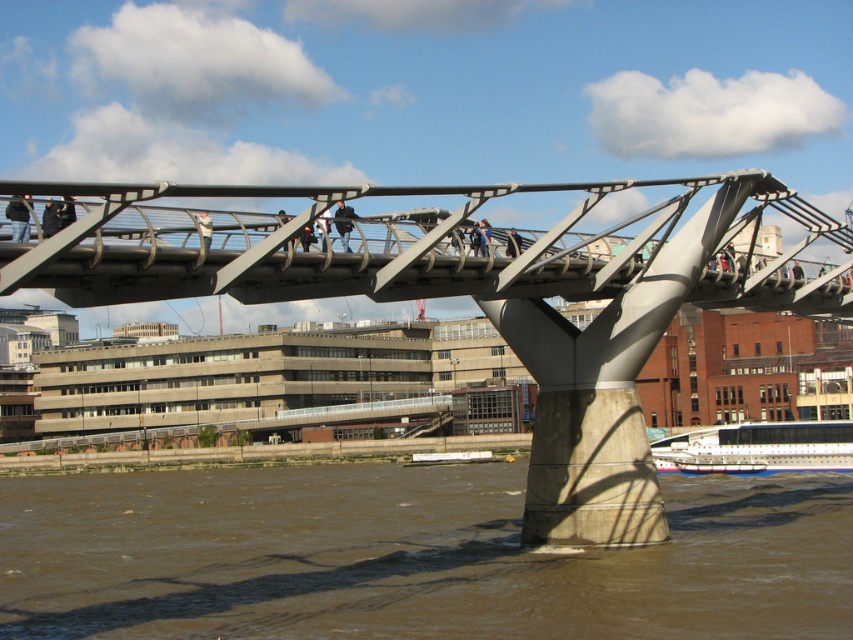
Is polished steel bridge at center bigger than dark blue jeans at center?

Correct, polished steel bridge at center is larger in size than dark blue jeans at center.

Find the location of a particular element. polished steel bridge at center is located at coordinates (473, 296).

What are the coordinates of `polished steel bridge at center` in the screenshot? It's located at (473, 296).

Measure the distance from dark blue jeans at center to black matte pedestrian at center.

dark blue jeans at center is 18.54 feet away from black matte pedestrian at center.

The image size is (853, 640). I want to click on dark blue jeans at center, so click(x=344, y=224).

Between dark blue jeans at left and black matte pedestrian at center, which one appears on the left side from the viewer's perspective?

dark blue jeans at left is more to the left.

From the picture: Between dark blue jeans at left and black matte pedestrian at center, which one has less height?

Standing shorter between the two is dark blue jeans at left.

Who is more forward, [16,209] or [508,248]?

Point [16,209] is more forward.

The height and width of the screenshot is (640, 853). In order to click on dark blue jeans at left in this screenshot , I will do `click(18, 220)`.